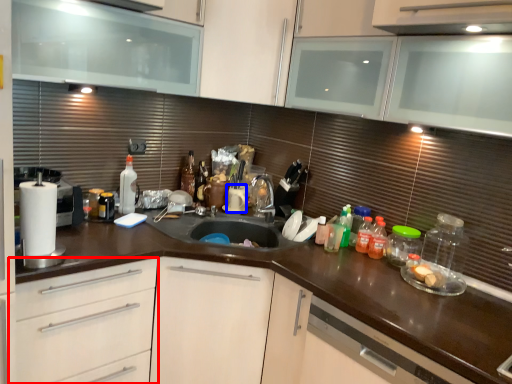
Question: Which object is closer to the camera taking this photo, drawer (highlighted by a red box) or appliance (highlighted by a blue box)?

Choices:
 (A) drawer
 (B) appliance

Answer: (A)